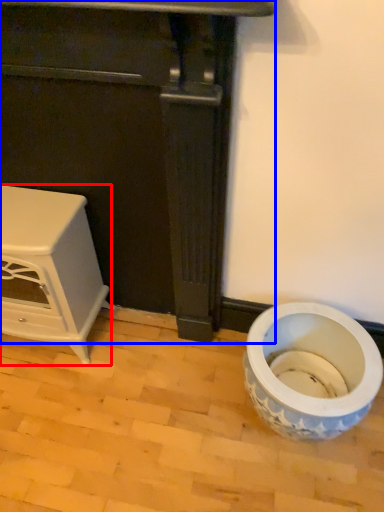
Question: Which point is closer to the camera, furniture (highlighted by a red box) or furniture (highlighted by a blue box)?

Choices:
 (A) furniture
 (B) furniture

Answer: (B)